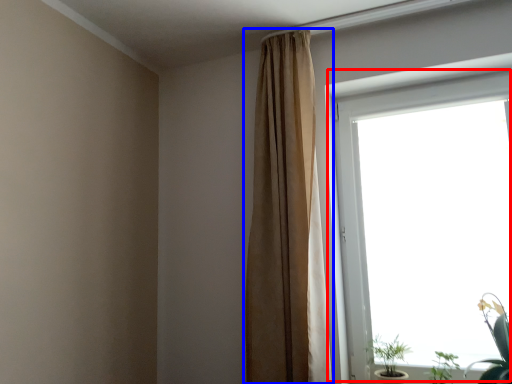
Question: Which point is closer to the camera, window (highlighted by a red box) or curtain (highlighted by a blue box)?

Choices:
 (A) window
 (B) curtain

Answer: (A)